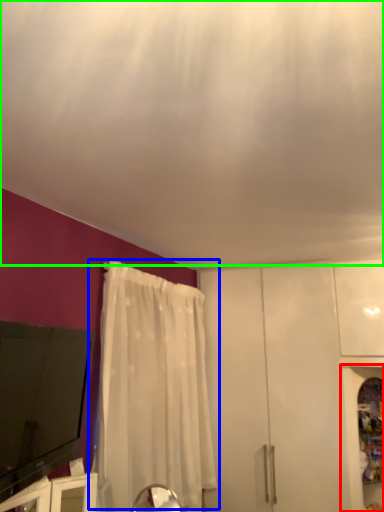
Question: Considering the real-world distances, which object is closest to cabinetry (highlighted by a red box)? curtain (highlighted by a blue box) or blind (highlighted by a green box).

Choices:
 (A) curtain
 (B) blind

Answer: (A)